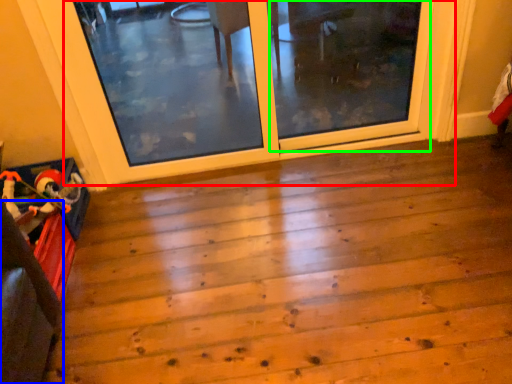
Question: Which object is positioned closest to screen door (highlighted by a red box)? Select from furniture (highlighted by a blue box) and screen door (highlighted by a green box).

Choices:
 (A) furniture
 (B) screen door

Answer: (B)